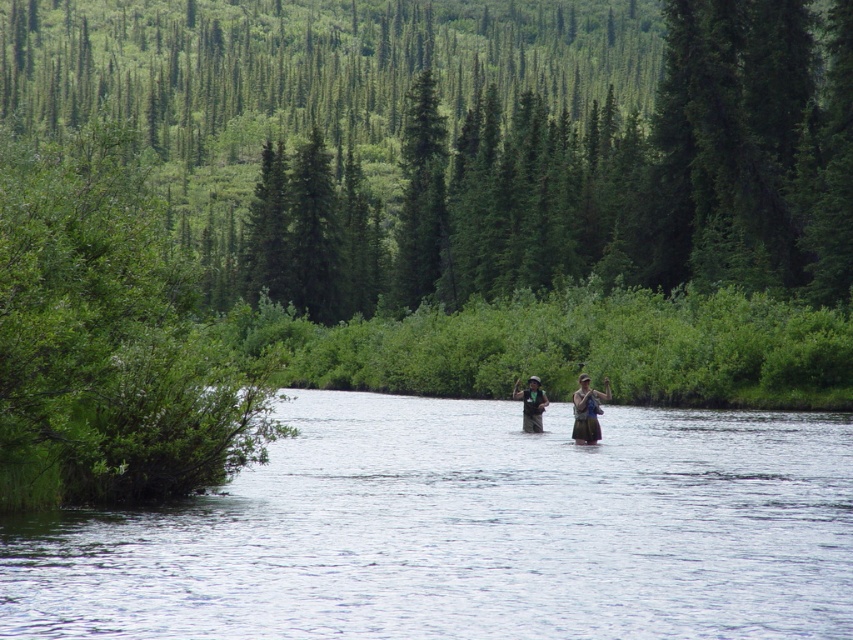
Between brown fabric jacket at center and green fabric vest at center, which one is positioned higher?

Positioned higher is brown fabric jacket at center.

Does brown fabric jacket at center appear under green fabric vest at center?

Incorrect, brown fabric jacket at center is not positioned below green fabric vest at center.

Is point (573, 410) closer to viewer compared to point (523, 404)?

Yes, it is.

Identify the location of brown fabric jacket at center. The height and width of the screenshot is (640, 853). (587, 410).

How much distance is there between clear water at center and brown fabric jacket at center?

clear water at center is 8.19 meters away from brown fabric jacket at center.

Can you confirm if clear water at center is taller than brown fabric jacket at center?

No, clear water at center is not taller than brown fabric jacket at center.

Locate an element on the screen. This screenshot has height=640, width=853. clear water at center is located at coordinates (467, 531).

Between point (671, 598) and point (527, 394), which one is positioned behind?

The point (527, 394) is more distant.

Is clear water at center shorter than green fabric vest at center?

Yes.

This screenshot has width=853, height=640. I want to click on clear water at center, so click(467, 531).